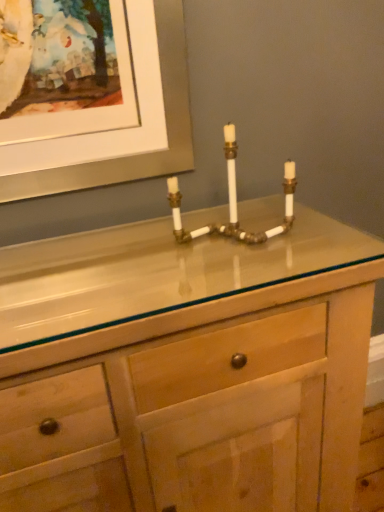
Where is `free point below brass/bronze pipe at center (from a real-world perspective)`? free point below brass/bronze pipe at center (from a real-world perspective) is located at coordinates (224, 246).